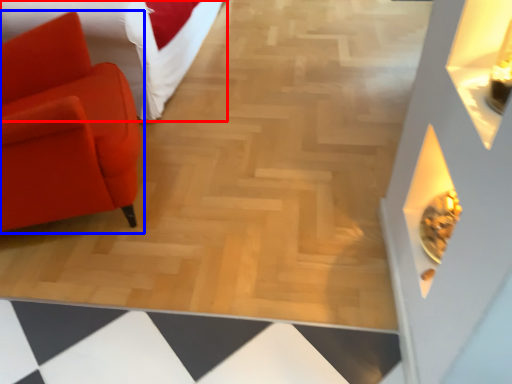
Question: Among these objects, which one is farthest to the camera, furniture (highlighted by a red box) or chair (highlighted by a blue box)?

Choices:
 (A) furniture
 (B) chair

Answer: (A)